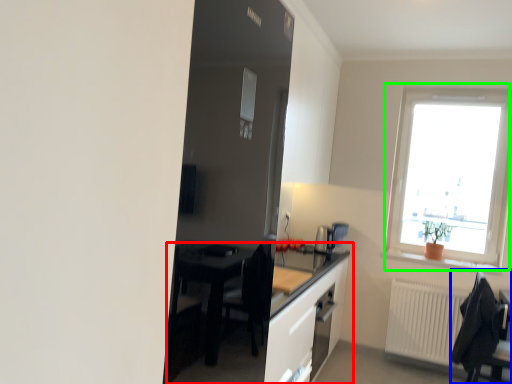
Question: Which is farther away from table (highlighted by a red box)? chair (highlighted by a blue box) or window (highlighted by a green box)?

Choices:
 (A) chair
 (B) window

Answer: (B)